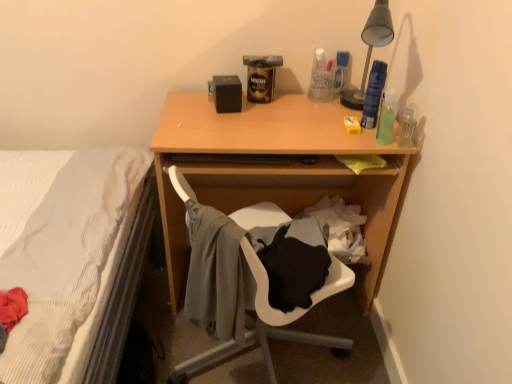
Find the location of a particular element. Image resolution: width=512 pixels, height=384 pixels. vacant area that lies between translucent green bottle at right, marked as the 1th bottle in a front-to-back arrangement, and black matte speaker at upper center is located at coordinates (297, 119).